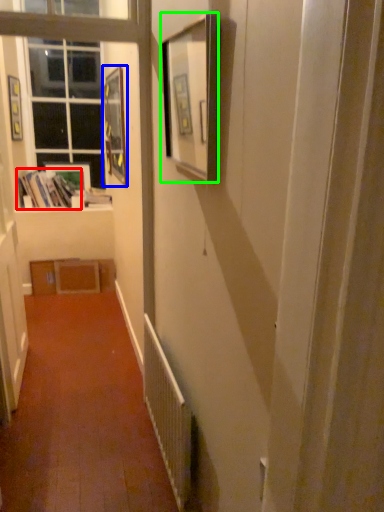
Question: Which object is positioned farthest from book (highlighted by a red box)? Select from picture frame (highlighted by a blue box) and picture frame (highlighted by a green box).

Choices:
 (A) picture frame
 (B) picture frame

Answer: (B)